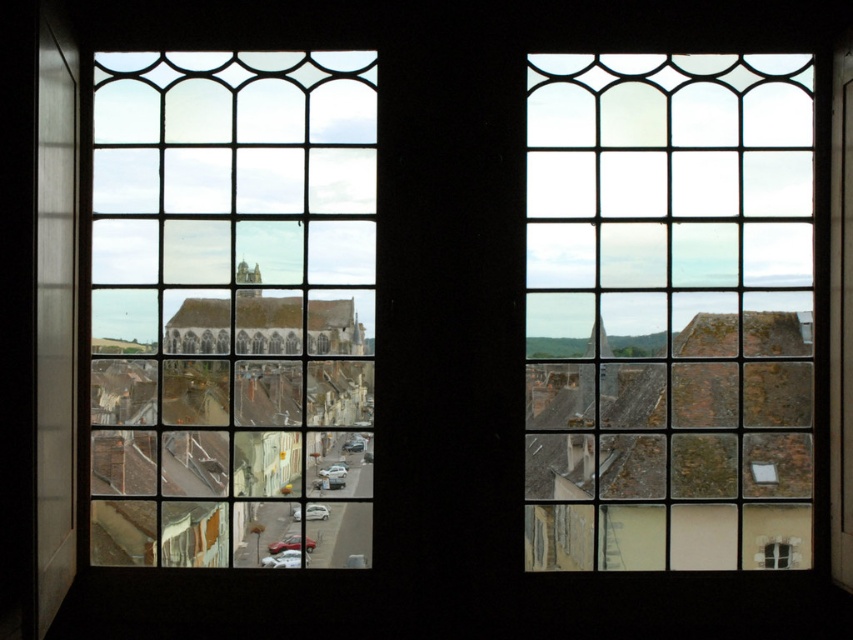
Is point (639, 374) positioned after point (294, 461)?

Yes.

Who is shorter, clear glass window at upper right or clear glass window at center?

With less height is clear glass window at upper right.

Measure the distance between clear glass window at upper right and camera.

clear glass window at upper right and camera are 57.78 feet apart.

What are the coordinates of `clear glass window at upper right` in the screenshot? It's located at click(669, 310).